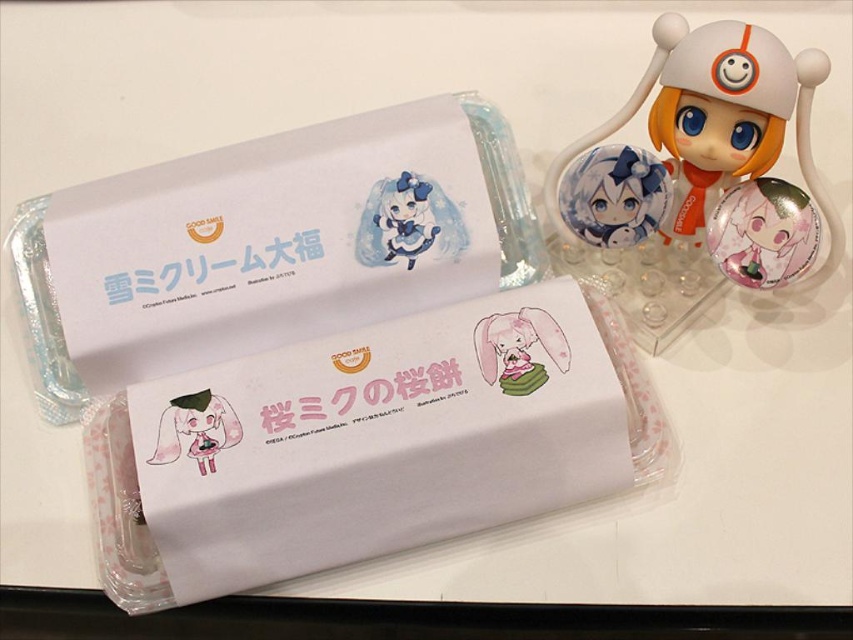
Question: Does matte blue plush at upper center appear over pink matte plush rabbit at center?

Choices:
 (A) yes
 (B) no

Answer: (A)

Question: Which point is farther from the camera taking this photo?

Choices:
 (A) (733, 268)
 (B) (519, 316)

Answer: (B)

Question: Can you confirm if white paper box at center is positioned to the left of pink glossy plushie at center?

Choices:
 (A) no
 (B) yes

Answer: (A)

Question: Among these points, which one is nearest to the camera?

Choices:
 (A) (282, 138)
 (B) (553, 291)
 (C) (811, 256)
 (D) (392, 209)

Answer: (C)

Question: Is pink matte paper box at center positioned behind satin pink figurine at upper right?

Choices:
 (A) yes
 (B) no

Answer: (B)

Question: Which object appears closest to the camera in this image?

Choices:
 (A) pink matte plush rabbit at center
 (B) white paper box at center

Answer: (B)